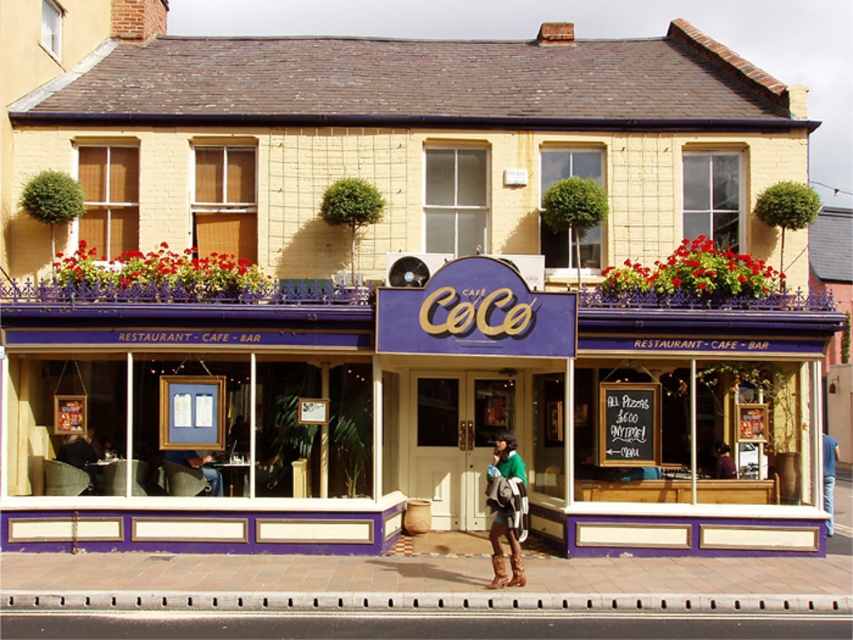
Is metallic gray curb at lower center further to camera compared to green fabric jacket at center?

No, metallic gray curb at lower center is closer to the viewer.

Is point (289, 602) closer to viewer compared to point (726, 445)?

Yes, point (289, 602) is closer to viewer.

Is point (177, 609) positioned after point (717, 465)?

No, (177, 609) is in front of (717, 465).

At what (x,y) coordinates should I click in order to perform the action: click on metallic gray curb at lower center. Please return your answer as a coordinate pair (x, y). Image resolution: width=853 pixels, height=640 pixels. Looking at the image, I should click on (416, 602).

Is green knitted sweater at center further to the viewer compared to green fabric jacket at center?

No, it is in front of green fabric jacket at center.

Does point (497, 577) come behind point (718, 452)?

No.

Is point (496, 520) in front of point (727, 458)?

That is True.

At what (x,y) coordinates should I click in order to perform the action: click on green knitted sweater at center. Please return your answer as a coordinate pair (x, y). Image resolution: width=853 pixels, height=640 pixels. Looking at the image, I should click on (502, 556).

Can you confirm if metallic gray curb at lower center is shorter than green knitted sweater at center?

Yes, metallic gray curb at lower center is shorter than green knitted sweater at center.

The width and height of the screenshot is (853, 640). What are the coordinates of `metallic gray curb at lower center` in the screenshot? It's located at (416, 602).